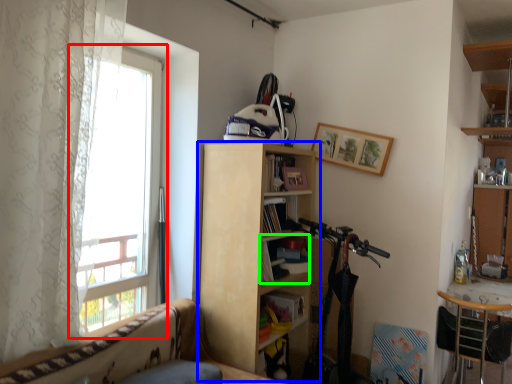
Question: Considering the real-world distances, which object is farthest from window (highlighted by a red box)? bookcase (highlighted by a blue box) or book (highlighted by a green box)?

Choices:
 (A) bookcase
 (B) book

Answer: (B)